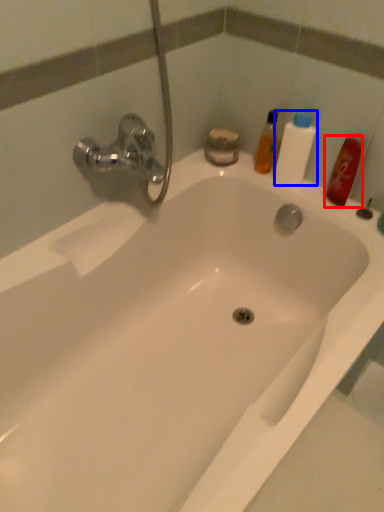
Question: Among these objects, which one is farthest to the camera, mouthwash (highlighted by a red box) or cleaning product (highlighted by a blue box)?

Choices:
 (A) mouthwash
 (B) cleaning product

Answer: (B)